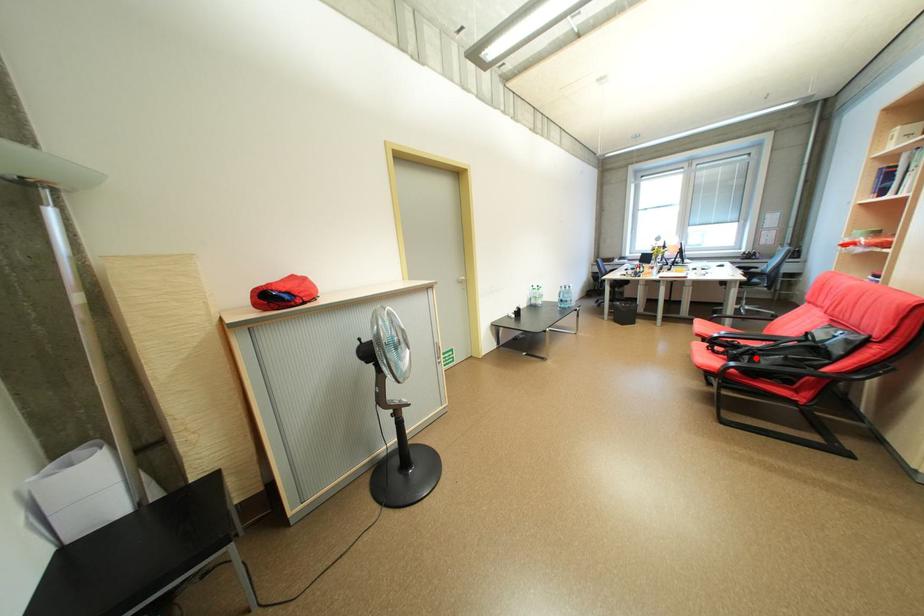
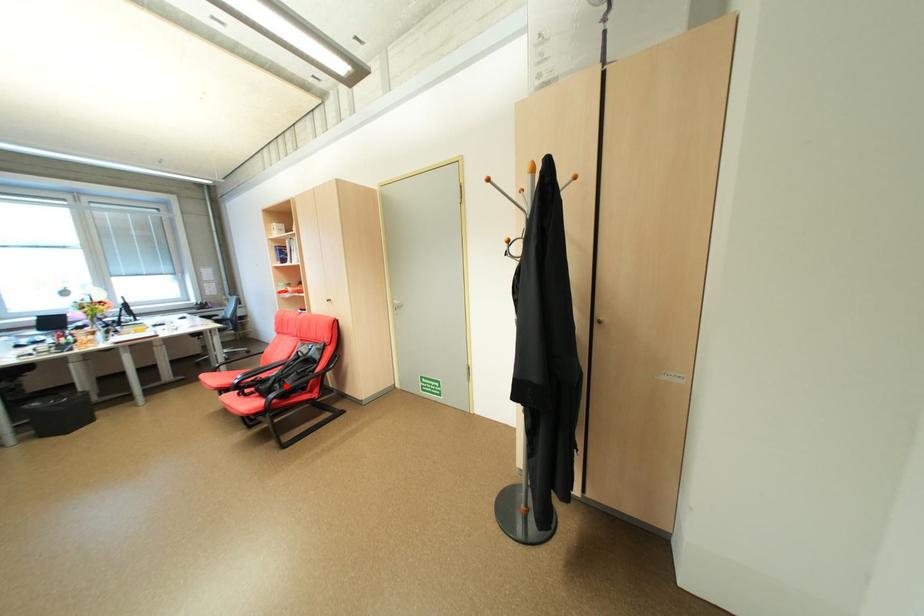
I am providing you with two images of the same scene from different viewpoints. A red point is marked on the first image and another point is marked on the second image. Is the marked point in image1 the same physical position as the marked point in image2?

Yes